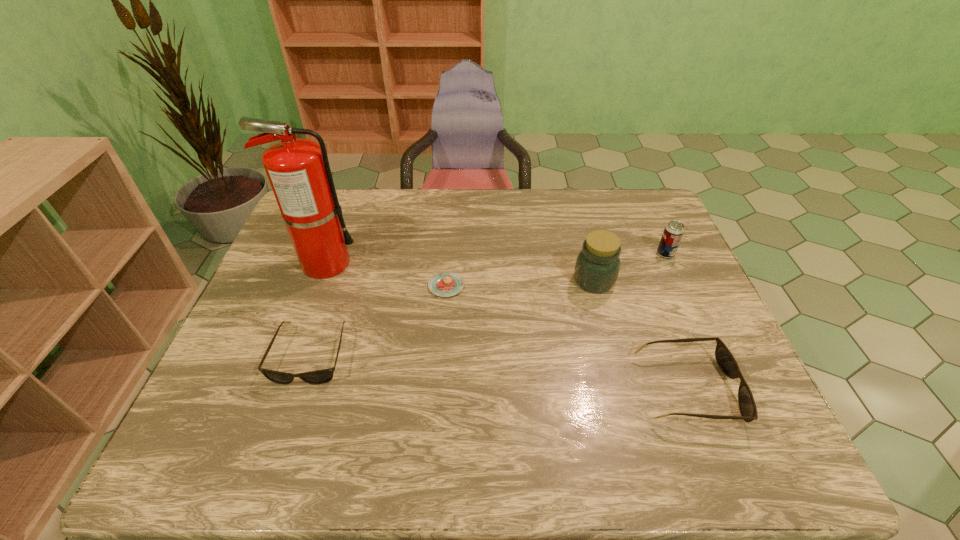
At what (x,y) coordinates should I click in order to perform the action: click on the left sunglasses. Please return your answer as a coordinate pair (x, y). Image resolution: width=960 pixels, height=540 pixels. Looking at the image, I should click on (323, 376).

At what (x,y) coordinates should I click in order to perform the action: click on the shorter sunglasses. Please return your answer as a coordinate pair (x, y). Looking at the image, I should click on (323, 376).

Where is `the taller sunglasses`? the taller sunglasses is located at coordinates (724, 358).

This screenshot has width=960, height=540. Find the location of `the right sunglasses`. the right sunglasses is located at coordinates (724, 358).

You are a GUI agent. You are given a task and a screenshot of the screen. Output one action in this format:
    pyautogui.click(x=<x>, y=<y>)
    Task: Click on the beer can
    
    Given the screenshot: What is the action you would take?
    pyautogui.click(x=673, y=232)

The height and width of the screenshot is (540, 960). In order to click on the fourth object from right to left in this screenshot , I will do `click(444, 284)`.

At what (x,y) coordinates should I click in order to perform the action: click on the shortest object. Please return your answer as a coordinate pair (x, y). Image resolution: width=960 pixels, height=540 pixels. Looking at the image, I should click on (444, 284).

Locate an element on the screen. the tallest object is located at coordinates (298, 170).

I want to click on jar, so click(x=597, y=266).

At what (x,y) coordinates should I click in order to perform the action: click on free space located on the front of the beer can. Please return your answer as a coordinate pair (x, y). This screenshot has height=540, width=960. Looking at the image, I should click on (690, 307).